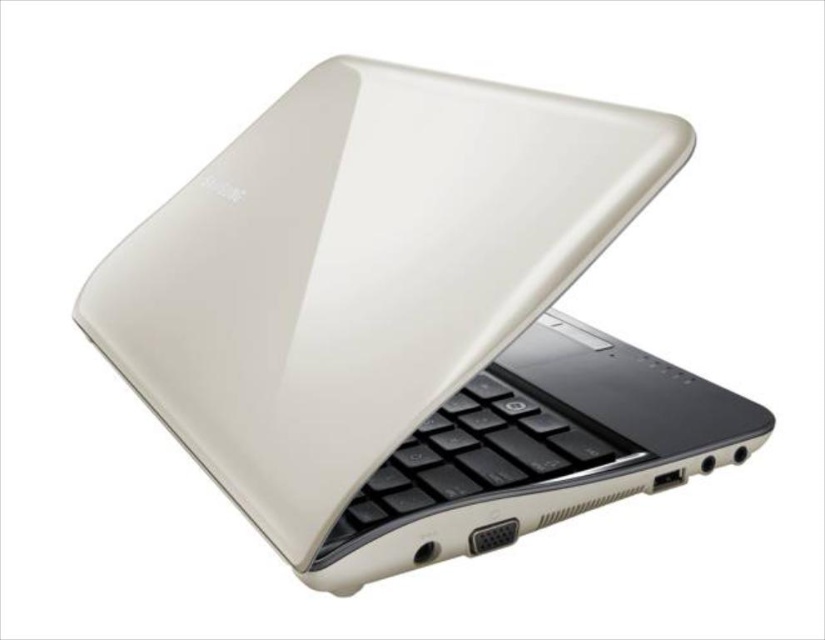
Is satin white laptop at center to the right of black matte keyboard at center from the viewer's perspective?

No, satin white laptop at center is not to the right of black matte keyboard at center.

You are a GUI agent. You are given a task and a screenshot of the screen. Output one action in this format:
    pyautogui.click(x=<x>, y=<y>)
    Task: Click on the satin white laptop at center
    The image size is (825, 640).
    Given the screenshot: What is the action you would take?
    pyautogui.click(x=408, y=321)

This screenshot has height=640, width=825. Identify the location of satin white laptop at center. (408, 321).

The image size is (825, 640). I want to click on satin white laptop at center, so click(x=408, y=321).